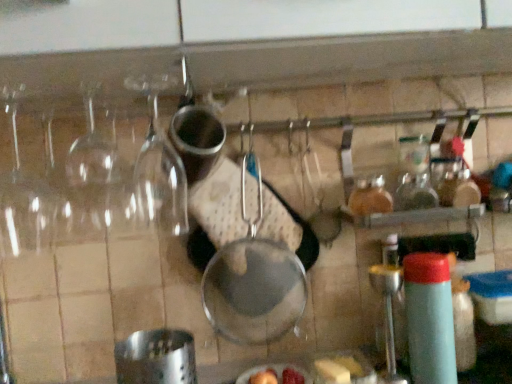
Question: Considering the positions of light blue plastic bottle at right and metallic silver frying pan at center in the image, is light blue plastic bottle at right bigger or smaller than metallic silver frying pan at center?

Choices:
 (A) small
 (B) big

Answer: (A)

Question: Which is correct: light blue plastic bottle at right is inside metallic silver frying pan at center, or outside of it?

Choices:
 (A) inside
 (B) outside

Answer: (B)

Question: Which of these objects is positioned farthest from the light blue plastic bottle at right?

Choices:
 (A) yellow butter at lower right
 (B) metallic silver frying pan at center

Answer: (B)

Question: Which object is the farthest from the metallic silver frying pan at center?

Choices:
 (A) light blue plastic bottle at right
 (B) yellow butter at lower right

Answer: (A)